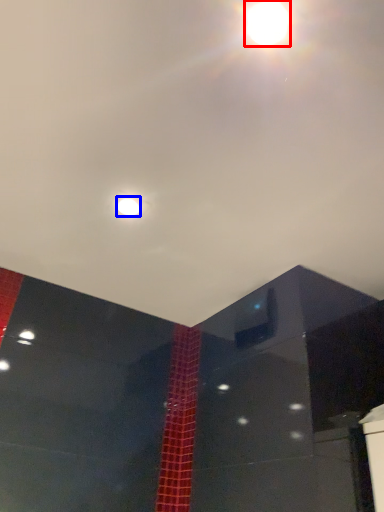
Question: Which object appears farthest to the camera in this image, lamp (highlighted by a red box) or light (highlighted by a blue box)?

Choices:
 (A) lamp
 (B) light

Answer: (B)